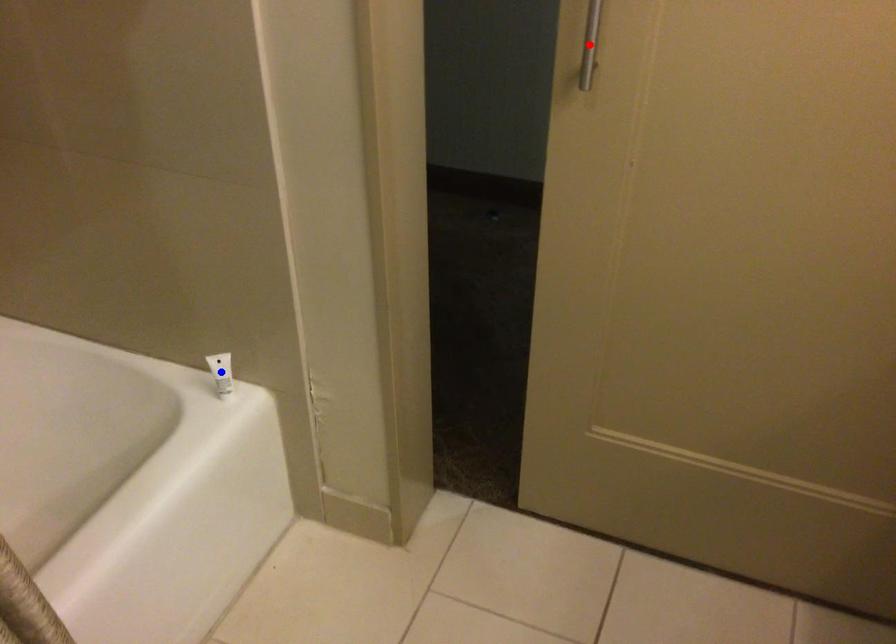
Question: In the image, two points are highlighted. Which point is nearer to the camera? Reply with the corresponding letter.

Choices:
 (A) blue point
 (B) red point

Answer: (B)